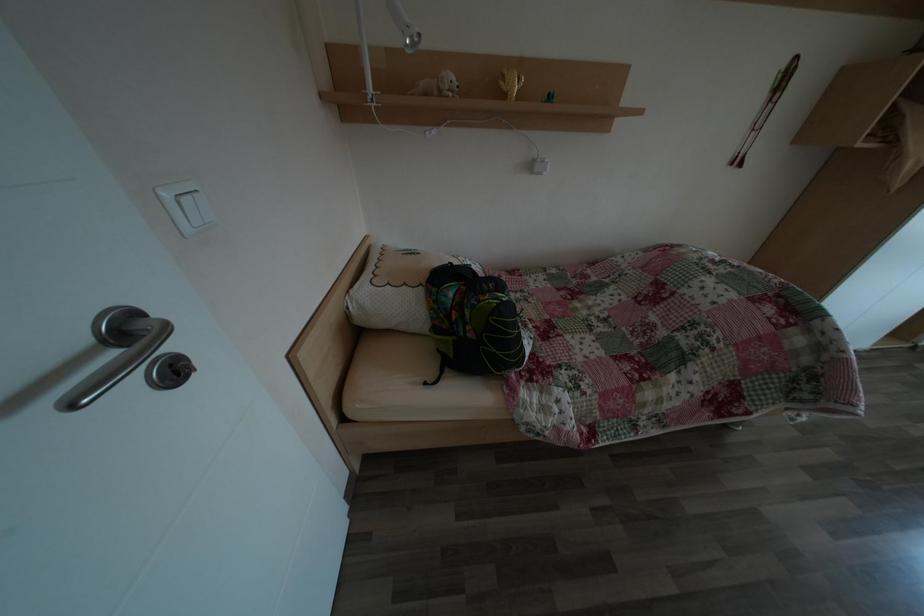
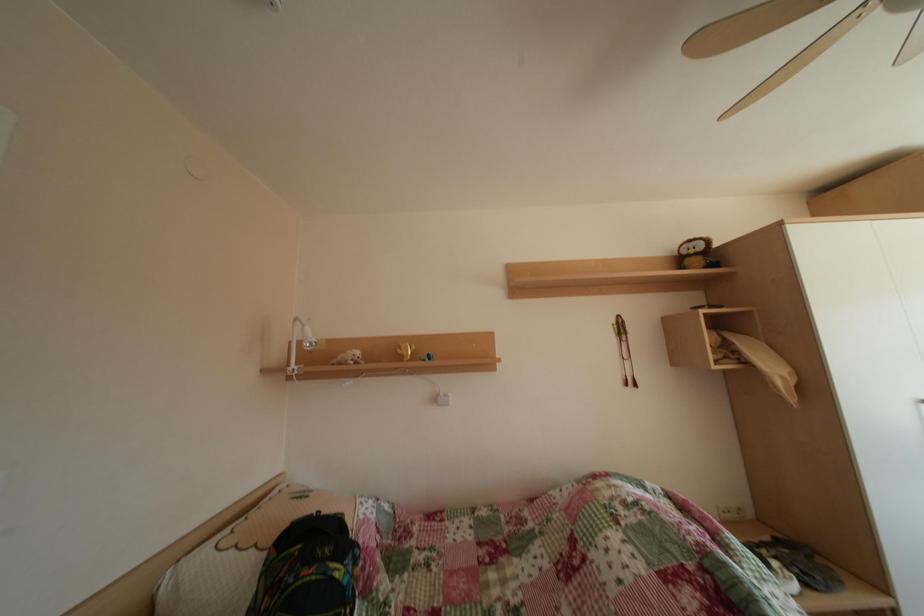
Question: The images are taken continuously from a first-person perspective. In which direction is your viewpoint rotating?

Choices:
 (A) Left
 (B) Right
 (C) Up
 (D) Down

Answer: (C)